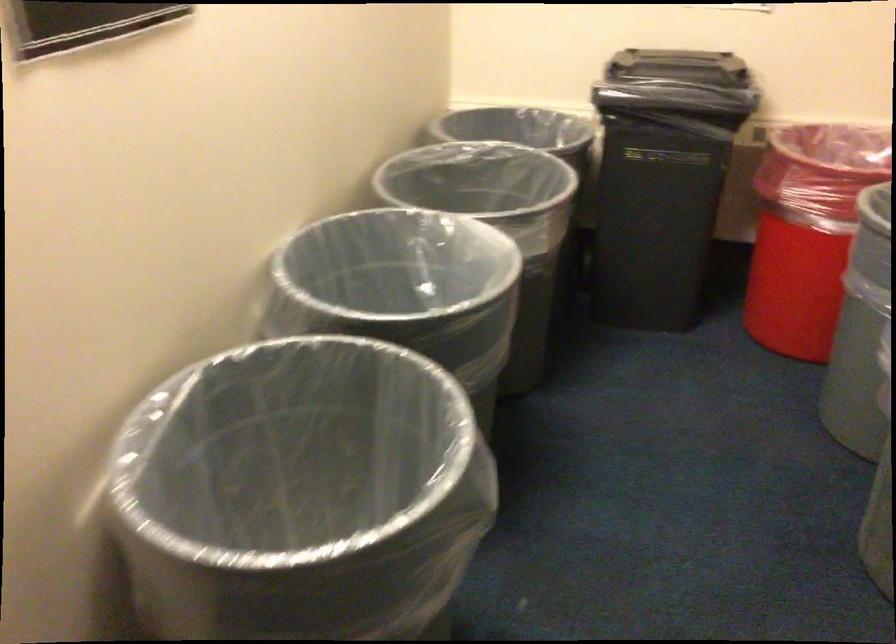
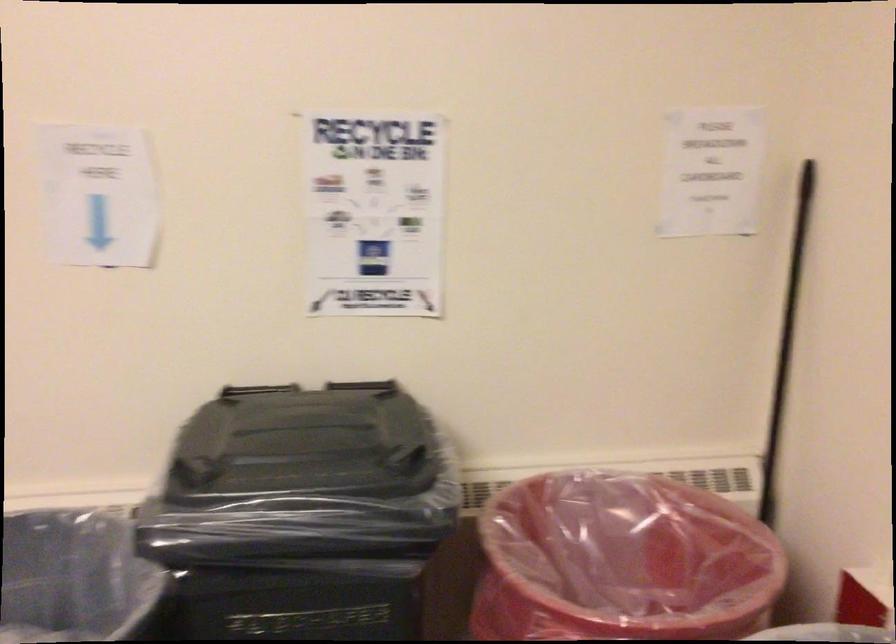
Which direction would the cameraman need to move to produce the second image?

The cameraman moved toward right, forward.